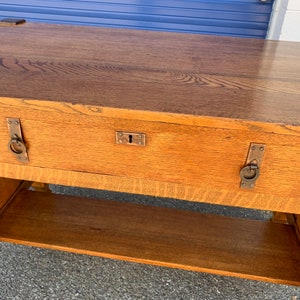
This screenshot has height=300, width=300. I want to click on white wall bricj, so click(289, 28).